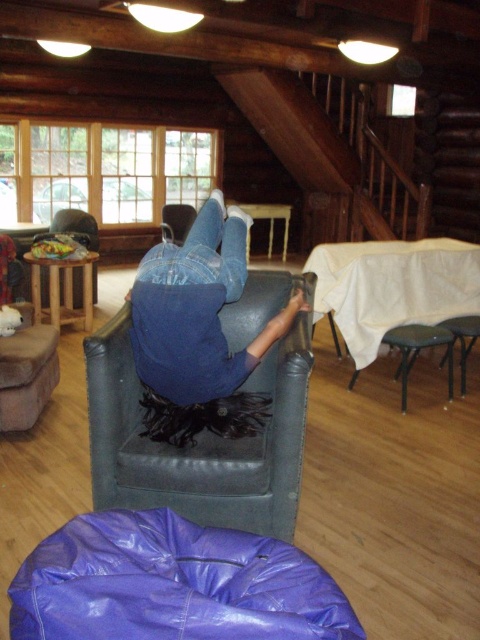
You are a delivery person who needs to place a package between the purple vinyl bean bag at lower center and the blue leather chair at center. The package is 90 centimeters long. Will it fit in the space between them?

The distance between the purple vinyl bean bag at lower center and the blue leather chair at center is 88.32 centimeters. Since the package is 90 centimeters long, it will not fit in the space between them.